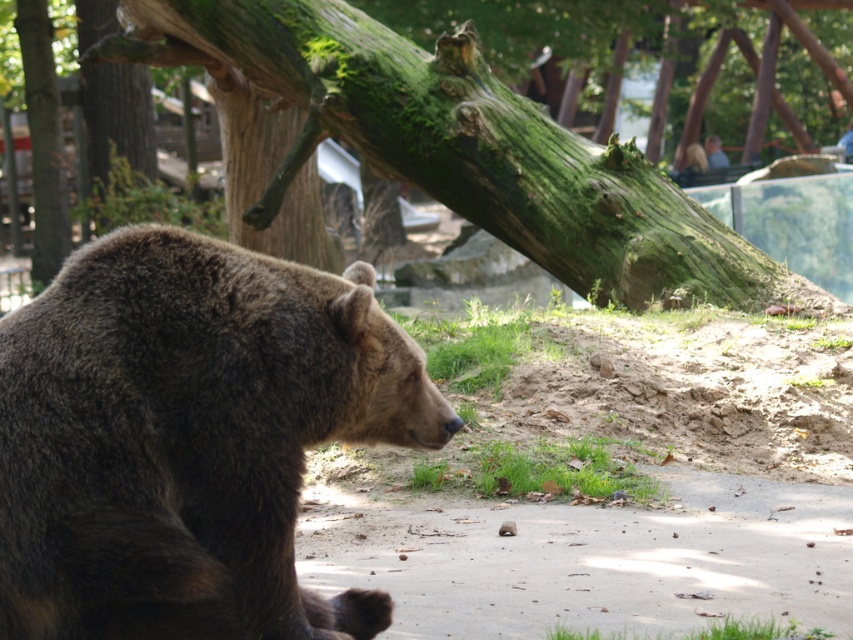
You are a zookeeper who needs to place a feeding station between the brown furry bear at center and the green mossy log at upper center. The feeding station requires a minimum of 15 feet of space. Can you fit it between them?

The brown furry bear at center is 20.88 feet from the green mossy log at upper center. Since the required space is 15 feet, the feeding station can be placed between them as there is sufficient space available.